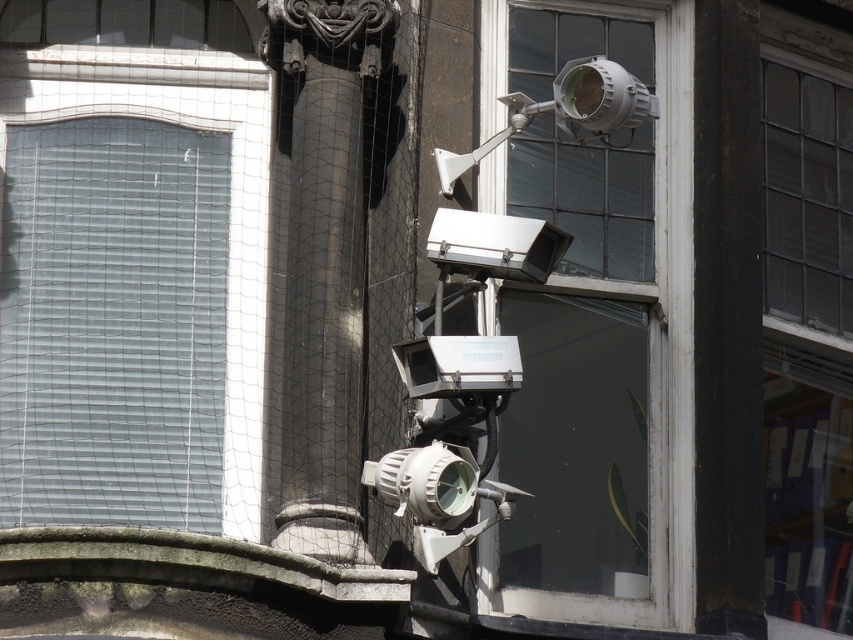
Question: Considering the relative positions of clear glass window at center and white plastic video camera at center in the image provided, where is clear glass window at center located with respect to white plastic video camera at center?

Choices:
 (A) right
 (B) left

Answer: (A)

Question: Which object appears closest to the camera in this image?

Choices:
 (A) white plastic video camera at center
 (B) matte white security camera at upper center
 (C) clear glass window at center

Answer: (A)

Question: Is white plastic video camera at center above matte white security camera at upper center?

Choices:
 (A) no
 (B) yes

Answer: (A)

Question: Can you confirm if clear glass window at center is wider than white plastic video camera at center?

Choices:
 (A) yes
 (B) no

Answer: (A)

Question: Among these objects, which one is nearest to the camera?

Choices:
 (A) matte white security camera at upper center
 (B) clear glass window at center
 (C) white plastic video camera at center

Answer: (C)

Question: Which object is farther from the camera taking this photo?

Choices:
 (A) matte white security camera at upper center
 (B) white plastic video camera at center

Answer: (A)